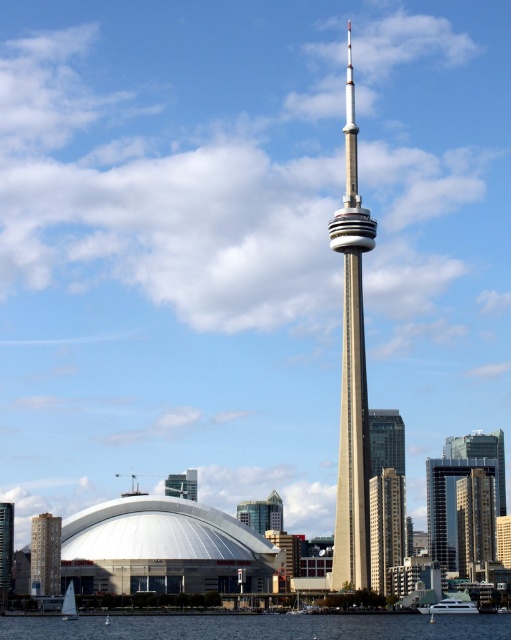
You are an architect reviewing a cityscape design. In the image, you see the silver metallic spire at center and the white sailboat at lower left. Which object is located to the right of the other?

The silver metallic spire at center is positioned on the right side of white sailboat at lower left.

You are standing at the center of the image and want to locate the brown brick building at lower left. According to its coordinates, in which direction should you look to find it?

The brown brick building at lower left is located at coordinates point (44,554). Since the coordinates are lower in the image, you should look to the lower left direction to find it.

You are standing at the base of the CN Tower and want to reach a specific point marked at coordinates point (11, 582). Given that the distance between you and this point is 1706.34 feet, can you estimate whether this point is within a 1.5 mile walking distance?

The distance between you and point (11, 582) is 1706.34 feet. Since 1.5 miles equals 7920 feet, the point is well within the 1.5 mile walking distance.